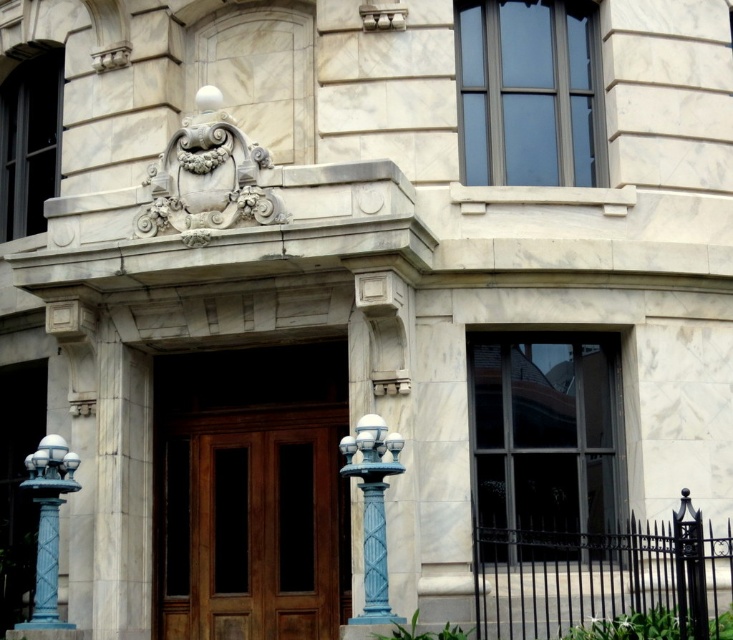
Question: Can you confirm if blue glossy column at center is thinner than blue painted metal/texture lamp post at left?

Choices:
 (A) yes
 (B) no

Answer: (A)

Question: Can you confirm if blue glossy column at center is positioned to the right of blue painted metal/texture lamp post at left?

Choices:
 (A) no
 (B) yes

Answer: (B)

Question: Estimate the real-world distances between objects in this image. Which object is closer to the blue glossy column at center?

Choices:
 (A) polished wood door at center
 (B) blue painted metal/texture lamp post at left

Answer: (A)

Question: Considering the real-world distances, which object is farthest from the blue glossy column at center?

Choices:
 (A) blue painted metal/texture lamp post at left
 (B) polished wood door at center

Answer: (A)

Question: Which of the following is the farthest from the observer?

Choices:
 (A) (55, 589)
 (B) (375, 593)
 (C) (306, 628)

Answer: (C)

Question: In this image, where is polished wood door at center located relative to blue painted metal/texture lamp post at left?

Choices:
 (A) left
 (B) right

Answer: (B)